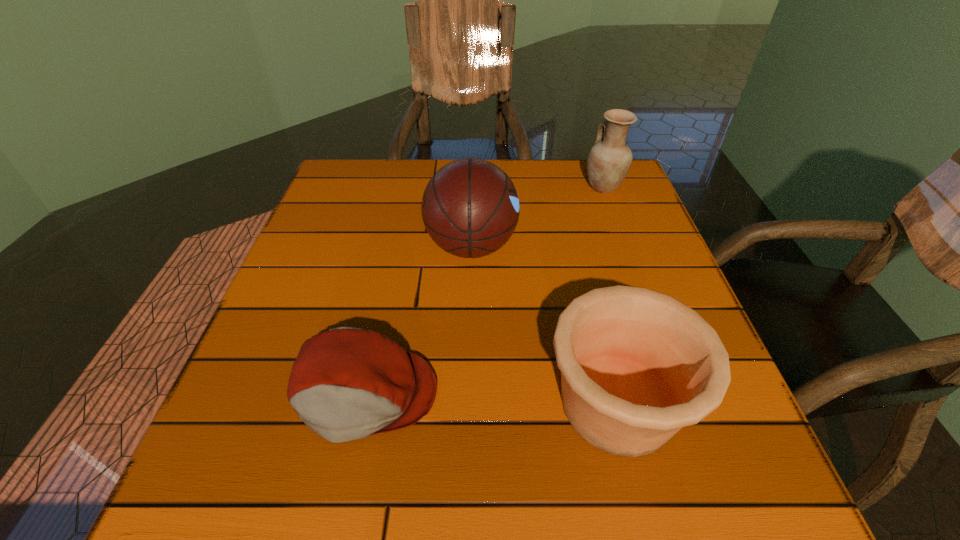
Locate an element on the screen. This screenshot has width=960, height=540. object present at the far edge is located at coordinates (609, 161).

Image resolution: width=960 pixels, height=540 pixels. I want to click on object that is positioned at the near edge, so click(x=636, y=365).

This screenshot has width=960, height=540. Find the location of `object that is at the left edge`. object that is at the left edge is located at coordinates (347, 383).

Locate an element on the screen. object situated at the far right corner is located at coordinates (609, 161).

Image resolution: width=960 pixels, height=540 pixels. Find the location of `object positioned at the near right corner`. object positioned at the near right corner is located at coordinates (636, 365).

Find the location of a particular element. This screenshot has width=960, height=540. vacant space at the far edge is located at coordinates (434, 163).

Find the location of `vacant space at the near edge`. vacant space at the near edge is located at coordinates (527, 514).

You are a GUI agent. You are given a task and a screenshot of the screen. Output one action in this format:
    pyautogui.click(x=<x>, y=<y>)
    Task: Click on the vacant space at the left edge of the desktop
    
    Given the screenshot: What is the action you would take?
    pyautogui.click(x=301, y=278)

Find the location of `free space at the right edge of the desktop`. free space at the right edge of the desktop is located at coordinates (607, 239).

The height and width of the screenshot is (540, 960). In order to click on blank space at the near right corner of the desktop in this screenshot , I will do `click(734, 481)`.